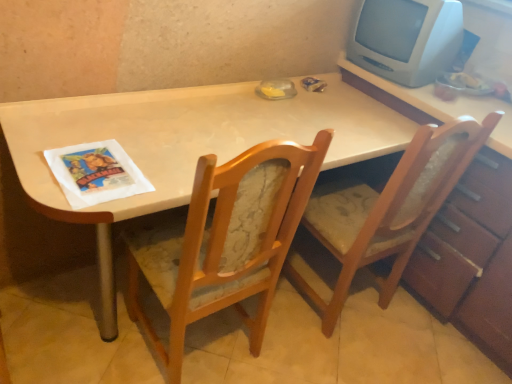
Find the location of a particular element. The height and width of the screenshot is (384, 512). free spot to the right of wooden textured chair at right, which is the second chair from left to right is located at coordinates (419, 340).